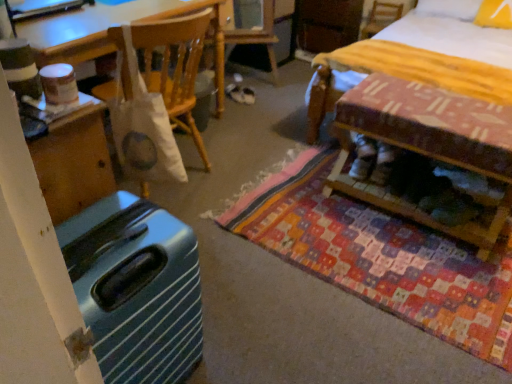
The height and width of the screenshot is (384, 512). What do you see at coordinates (426, 145) in the screenshot?
I see `wooden bench at lower right` at bounding box center [426, 145].

This screenshot has height=384, width=512. Describe the element at coordinates (380, 17) in the screenshot. I see `wooden chair at upper right` at that location.

This screenshot has width=512, height=384. What do you see at coordinates (166, 67) in the screenshot?
I see `white fabric bag at upper center` at bounding box center [166, 67].

Describe the element at coordinates (362, 158) in the screenshot. I see `white suede shoes at center` at that location.

Describe the element at coordinates (136, 289) in the screenshot. I see `teal glossy suitcase at lower left` at that location.

The width and height of the screenshot is (512, 384). Find the location of `wooden bench at lower right`. wooden bench at lower right is located at coordinates (426, 145).

Can white suede shoes at center be found inside wooden chair at upper right?

No, white suede shoes at center is not a part of wooden chair at upper right.

Looking at this image, which of these two, wooden chair at upper right or white suede shoes at center, is smaller?

With smaller size is white suede shoes at center.

Considering the positions of points (392, 19) and (370, 167), is point (392, 19) farther from camera compared to point (370, 167)?

Yes, it is behind point (370, 167).

Can you confirm if yellow fabric pillow at upper right is smaller than teal glossy suitcase at lower left?

Yes, yellow fabric pillow at upper right is smaller than teal glossy suitcase at lower left.

Is yellow fabric pillow at upper right thinner than teal glossy suitcase at lower left?

Yes, yellow fabric pillow at upper right is thinner than teal glossy suitcase at lower left.

Locate an element on the screen. This screenshot has height=384, width=512. pillow behind the teal glossy suitcase at lower left is located at coordinates (494, 14).

Considering the sizes of teal glossy suitcase at lower left and yellow striped fabric bed at upper right in the image, is teal glossy suitcase at lower left wider or thinner than yellow striped fabric bed at upper right?

Considering their sizes, teal glossy suitcase at lower left looks slimmer than yellow striped fabric bed at upper right.

Is yellow striped fabric bed at upper right at the back of teal glossy suitcase at lower left?

teal glossy suitcase at lower left is not turned away from yellow striped fabric bed at upper right.

From a real-world perspective, which object stands above the other?

yellow striped fabric bed at upper right.

Based on the photo, how different are the orientations of teal glossy suitcase at lower left and yellow striped fabric bed at upper right in degrees?

The angular difference between teal glossy suitcase at lower left and yellow striped fabric bed at upper right is 179 degrees.

Which object is thinner, yellow fabric pillow at upper right or wooden bench at lower right?

yellow fabric pillow at upper right.

Identify the location of pillow on the right side of wooden bench at lower right. (494, 14).

Does yellow fabric pillow at upper right have a lesser height compared to wooden bench at lower right?

Yes, yellow fabric pillow at upper right is shorter than wooden bench at lower right.

Which object is closer to the camera taking this photo, yellow fabric pillow at upper right or wooden bench at lower right?

wooden bench at lower right.

Are teal glossy suitcase at lower left and white suede shoes at center located far from each other?

Indeed, teal glossy suitcase at lower left is not near white suede shoes at center.

From the image's perspective, which one is positioned lower, teal glossy suitcase at lower left or white suede shoes at center?

teal glossy suitcase at lower left.

Considering their positions, is teal glossy suitcase at lower left located in front of or behind white suede shoes at center?

teal glossy suitcase at lower left is in front of white suede shoes at center.

Who is taller, white fabric bag at upper center or patchwork fabric mat at center?

white fabric bag at upper center.

In terms of width, does white fabric bag at upper center look wider or thinner when compared to patchwork fabric mat at center?

Clearly, white fabric bag at upper center has less width compared to patchwork fabric mat at center.

In the scene shown: Is white fabric bag at upper center oriented away from patchwork fabric mat at center?

white fabric bag at upper center is not turned away from patchwork fabric mat at center.

The height and width of the screenshot is (384, 512). I want to click on chair that appears above the patchwork fabric mat at center (from a real-world perspective), so click(166, 67).

Which is more to the left, wooden bench at lower right or patchwork fabric mat at center?

Positioned to the left is patchwork fabric mat at center.

What's the angular difference between wooden bench at lower right and patchwork fabric mat at center's facing directions?

The facing directions of wooden bench at lower right and patchwork fabric mat at center are 0.276 degrees apart.

From the image's perspective, is wooden bench at lower right on patchwork fabric mat at center?

Correct, wooden bench at lower right appears higher than patchwork fabric mat at center in the image.

Who is smaller, wooden bench at lower right or patchwork fabric mat at center?

patchwork fabric mat at center is smaller.

Find the location of a particular element. The image size is (512, 384). armchair above the white suede shoes at center (from a real-world perspective) is located at coordinates (380, 17).

The width and height of the screenshot is (512, 384). I want to click on luggage in front of the yellow fabric pillow at upper right, so click(x=136, y=289).

Looking at the image, which one is located further to patchwork fabric mat at center, white suede shoes at center or white fabric bag at upper center?

white fabric bag at upper center is further to patchwork fabric mat at center.

From the image, which object appears to be nearer to wooden bench at lower right, white fabric bag at upper center or white suede shoes at center?

The object closer to wooden bench at lower right is white suede shoes at center.

From the image, which object appears to be farther from white fabric bag at upper center, white suede shoes at center or yellow fabric pillow at upper right?

The object further to white fabric bag at upper center is yellow fabric pillow at upper right.

Considering their positions, is wooden chair at upper right positioned further to white suede shoes at center than yellow striped fabric bed at upper right?

wooden chair at upper right lies further to white suede shoes at center than the other object.

In the scene shown: Considering their positions, is yellow striped fabric bed at upper right positioned closer to white suede shoes at center than white fabric bag at upper center?

The object closer to white suede shoes at center is white fabric bag at upper center.

Estimate the real-world distances between objects in this image. Which object is closer to wooden chair at upper right, white suede shoes at center or yellow fabric pillow at upper right?

yellow fabric pillow at upper right lies closer to wooden chair at upper right than the other object.

When comparing their distances from teal glossy suitcase at lower left, does yellow fabric pillow at upper right or yellow striped fabric bed at upper right seem further?

The object further to teal glossy suitcase at lower left is yellow fabric pillow at upper right.

Which object lies further to the anchor point yellow striped fabric bed at upper right, white fabric bag at upper center or white suede shoes at center?

The object further to yellow striped fabric bed at upper right is white fabric bag at upper center.

Where is `table between white fabric bag at upper center and yellow fabric pillow at upper right from left to right`? table between white fabric bag at upper center and yellow fabric pillow at upper right from left to right is located at coordinates (426, 145).

At what (x,y) coordinates should I click in order to perform the action: click on mat between teal glossy suitcase at lower left and wooden chair at upper right from front to back. Please return your answer as a coordinate pair (x, y). Looking at the image, I should click on (381, 257).

Where is `bed between wooden bench at lower right and yellow fabric pillow at upper right in the front-back direction`? bed between wooden bench at lower right and yellow fabric pillow at upper right in the front-back direction is located at coordinates (450, 32).

At what (x,y) coordinates should I click in order to perform the action: click on table located between patchwork fabric mat at center and yellow fabric pillow at upper right in the depth direction. Please return your answer as a coordinate pair (x, y). Image resolution: width=512 pixels, height=384 pixels. Looking at the image, I should click on (426, 145).